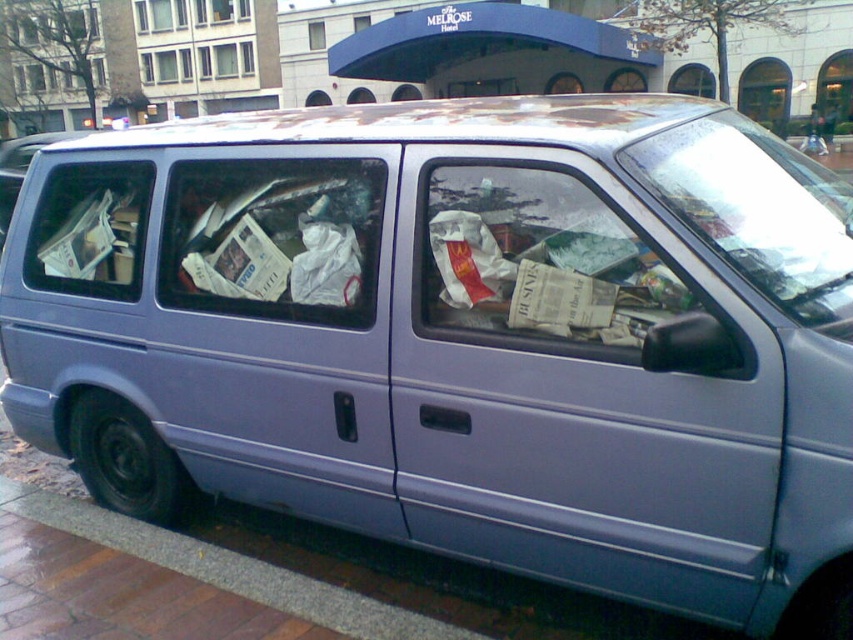
Is gray concrete curb at lower left positioned at the back of matte plastic van at center?

That is False.

You are a GUI agent. You are given a task and a screenshot of the screen. Output one action in this format:
    pyautogui.click(x=<x>, y=<y>)
    Task: Click on the gray concrete curb at lower left
    
    Given the screenshot: What is the action you would take?
    pyautogui.click(x=227, y=568)

The height and width of the screenshot is (640, 853). What do you see at coordinates (227, 568) in the screenshot? I see `gray concrete curb at lower left` at bounding box center [227, 568].

This screenshot has width=853, height=640. I want to click on gray concrete curb at lower left, so click(x=227, y=568).